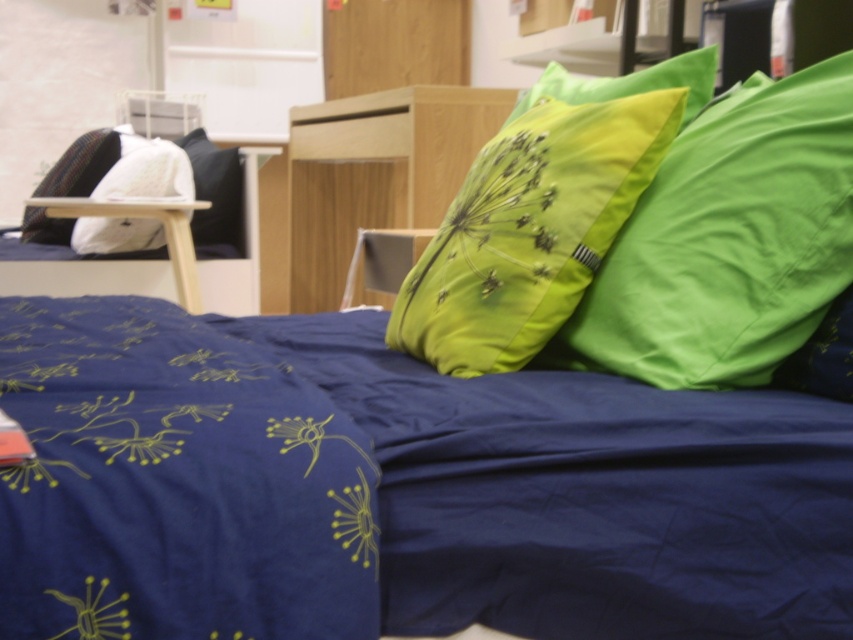
You are a customer in a furniture store looking at the bed. There are two points marked on the bedspread. Which point, point (268, 540) or point (32, 218), is closer to you?

Point (268, 540) is closer to the camera than point (32, 218).

You are a customer in a furniture store looking at the bed. You want to know the exact position of the navy blue satin blanket at lower left. Can you tell me where it is located in terms of coordinates?

The navy blue satin blanket at lower left is located at coordinates point (175, 483).

You are a customer in a furniture store looking at the bed. You want to place a 12 inch long decorative item between the navy blue satin blanket at lower left and the green fabric pillow at center. Can you fit it there?

The navy blue satin blanket at lower left is 16.50 inches away from the green fabric pillow at center, so yes, the 12 inch long decorative item can fit between them since the distance is greater than the item length.